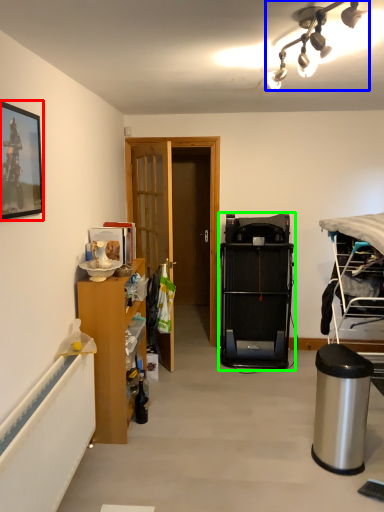
Question: Which is nearer to the picture frame (highlighted by a red box)? lamp (highlighted by a blue box) or bunk bed (highlighted by a green box).

Choices:
 (A) lamp
 (B) bunk bed

Answer: (A)